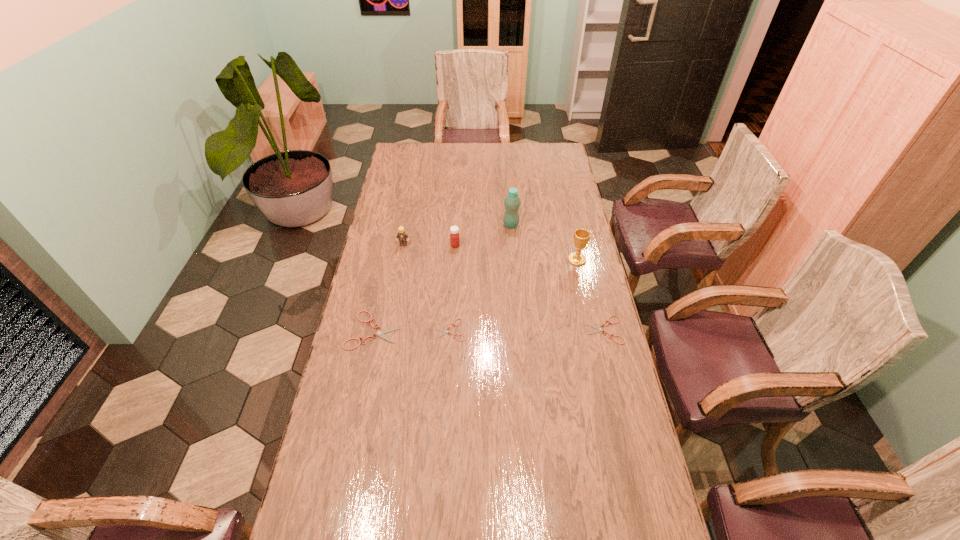
Where is `the fourth farthest object`? The image size is (960, 540). the fourth farthest object is located at coordinates (581, 236).

You are a GUI agent. You are given a task and a screenshot of the screen. Output one action in this format:
    pyautogui.click(x=<x>, y=<y>)
    Task: Click on the medicine
    This screenshot has width=960, height=540.
    Given the screenshot: What is the action you would take?
    pyautogui.click(x=454, y=235)

I want to click on vacant point located on the right of the fifth tallest object, so click(x=472, y=330).

At what (x,y) coordinates should I click in order to perform the action: click on vacant space located on the front of the second shears from right to left. Please return your answer as a coordinate pair (x, y). Image resolution: width=960 pixels, height=540 pixels. Looking at the image, I should click on (445, 428).

At what (x,y) coordinates should I click in order to perform the action: click on vacant area situated on the front of the sixth tallest object. Please return your answer as a coordinate pair (x, y). Looking at the image, I should click on (616, 378).

The height and width of the screenshot is (540, 960). In order to click on vacant region located in front of the Lego in this screenshot , I will do `click(393, 306)`.

Identify the location of vacant position located at the front cap of the third object from right to left. (515, 275).

Find the location of `vacant space situated 0.380m on the front of the fourth nearest object`. vacant space situated 0.380m on the front of the fourth nearest object is located at coordinates [x=595, y=345].

This screenshot has height=540, width=960. I want to click on blank area located on the front of the medicine, so click(x=452, y=292).

Locate an element on the screen. This screenshot has height=540, width=960. shears positioned at the left edge is located at coordinates (381, 333).